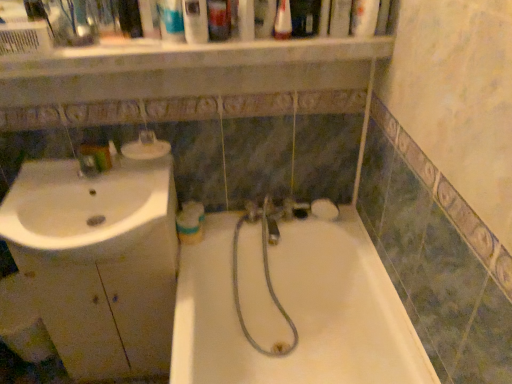
Find the location of a particular element. vacant area that is in front of matte plastic container at upper left, the second toiletry positioned from the right is located at coordinates (118, 182).